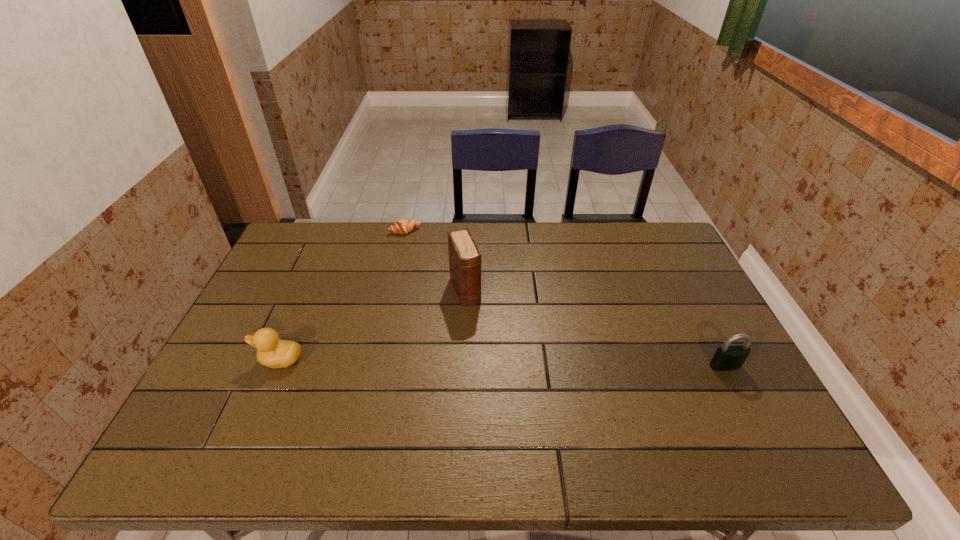
This screenshot has width=960, height=540. Find the location of `the leftmost object`. the leftmost object is located at coordinates (271, 352).

Locate an element on the screen. The width and height of the screenshot is (960, 540). padlock is located at coordinates (x=726, y=358).

Locate an element on the screen. the third nearest object is located at coordinates (465, 261).

Locate an element on the screen. the third object from left to right is located at coordinates (465, 261).

Identify the location of the third object from right to left. The width and height of the screenshot is (960, 540). (402, 226).

Locate an element on the screen. The width and height of the screenshot is (960, 540). pastry is located at coordinates (402, 226).

The image size is (960, 540). I want to click on vacant space located 0.090m facing forward on the leftmost object, so click(x=222, y=360).

The width and height of the screenshot is (960, 540). Identify the location of free spot located facing forward on the leftmost object. (222, 360).

The height and width of the screenshot is (540, 960). Find the location of `free space located facing forward on the leftmost object`. free space located facing forward on the leftmost object is located at coordinates (237, 360).

I want to click on free space located 0.390m on the left of the padlock, so click(557, 366).